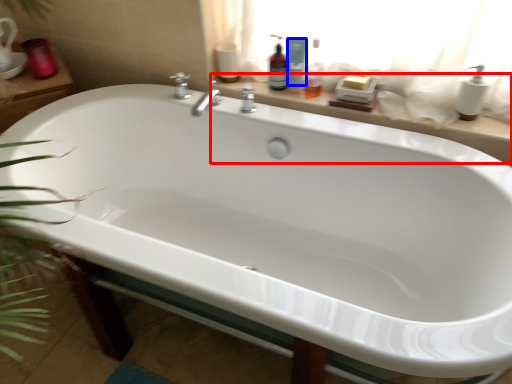
Question: Which point is further to the camera, window sill (highlighted by a red box) or cleaning product (highlighted by a blue box)?

Choices:
 (A) window sill
 (B) cleaning product

Answer: (B)